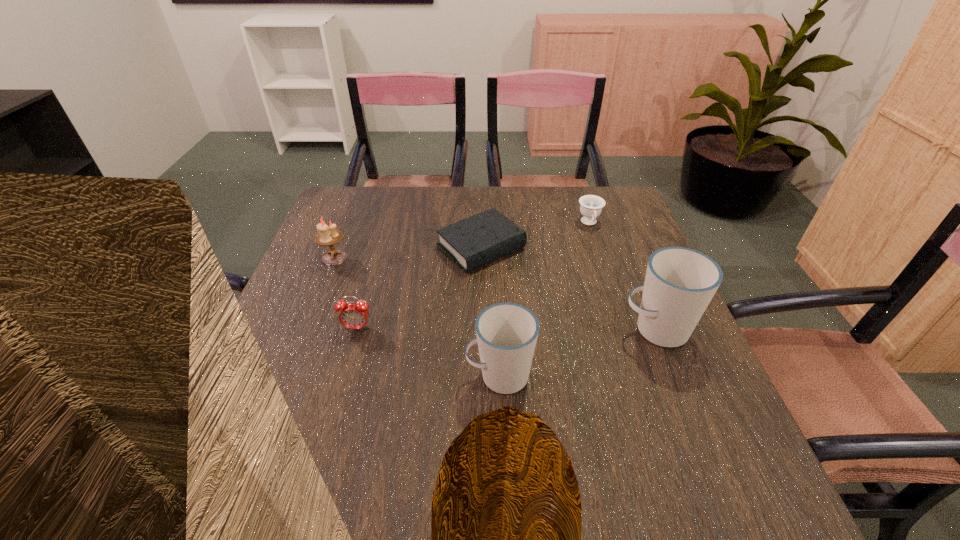
The height and width of the screenshot is (540, 960). I want to click on candle holder at the left edge, so click(x=328, y=236).

At what (x,y) coordinates should I click in order to perform the action: click on alarm clock at the left edge. Please return your answer as a coordinate pair (x, y). The height and width of the screenshot is (540, 960). Looking at the image, I should click on (352, 315).

At what (x,y) coordinates should I click in order to perform the action: click on cup at the right edge. Please return your answer as a coordinate pair (x, y). This screenshot has width=960, height=540. Looking at the image, I should click on (680, 282).

Find the location of `teacup that is at the right edge`. teacup that is at the right edge is located at coordinates (591, 206).

Find the location of a particular element. The width and height of the screenshot is (960, 540). object located in the far right corner section of the desktop is located at coordinates (591, 206).

Where is `free space at the far edge of the desktop`? Image resolution: width=960 pixels, height=540 pixels. free space at the far edge of the desktop is located at coordinates (429, 199).

The width and height of the screenshot is (960, 540). I want to click on vacant space at the near edge of the desktop, so [628, 446].

At what (x,y) coordinates should I click in order to perform the action: click on vacant region at the left edge of the desktop. Please return your answer as a coordinate pair (x, y). Looking at the image, I should click on (317, 262).

This screenshot has width=960, height=540. In the image, there is a desktop. What are the coordinates of `vacant space at the right edge` in the screenshot? It's located at (641, 240).

The height and width of the screenshot is (540, 960). In order to click on free space at the far left corner of the desktop in this screenshot , I will do `click(346, 227)`.